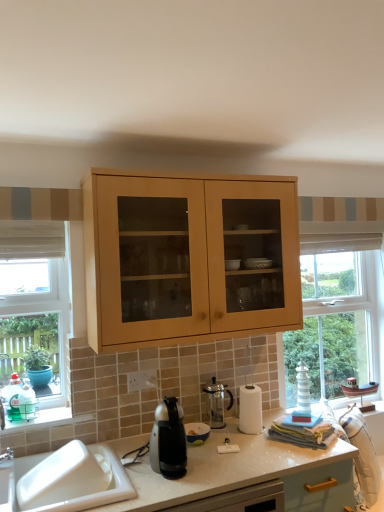
I want to click on free spot to the right of satin black coffee maker at center, so click(x=209, y=467).